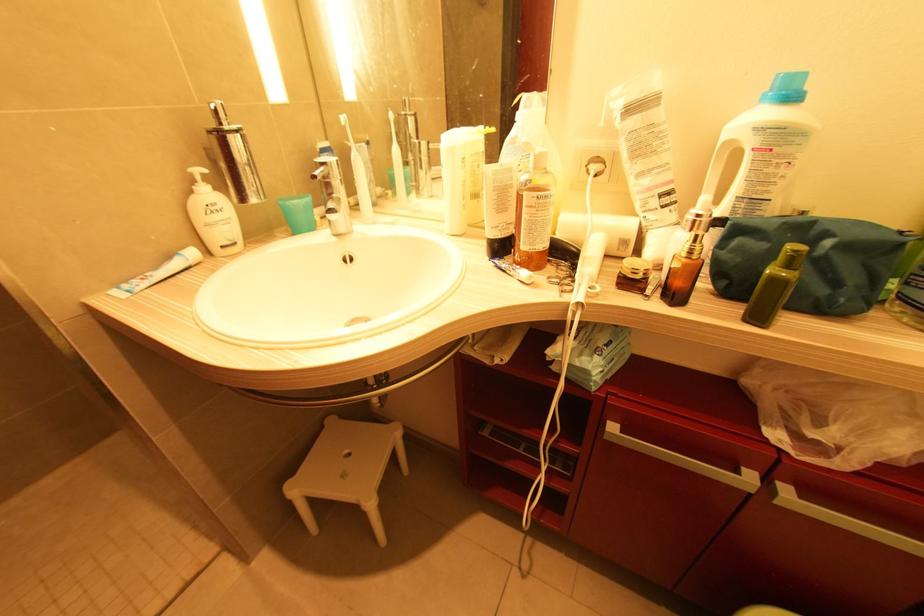
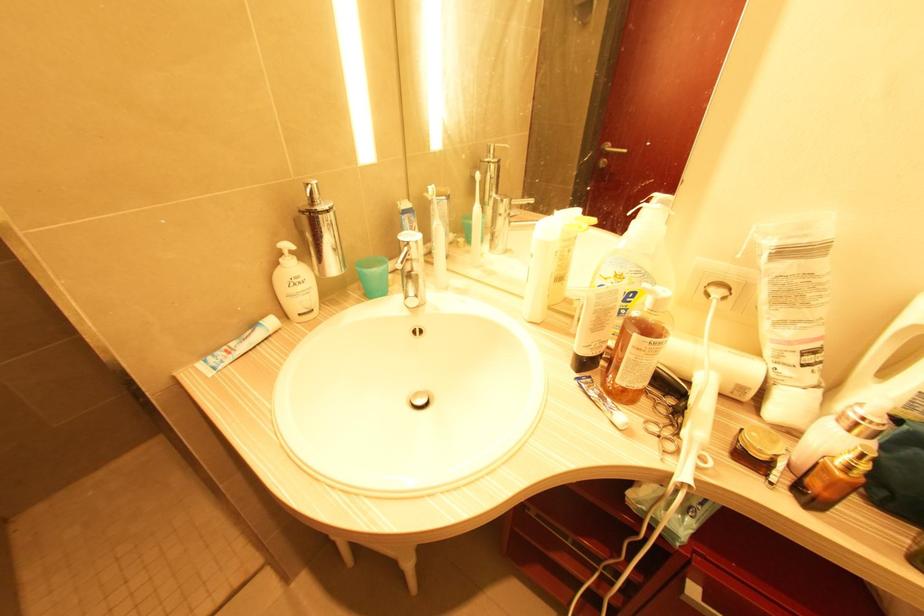
The images are taken continuously from a first-person perspective. In which direction are you moving?

The cameraman walked toward left, forward.